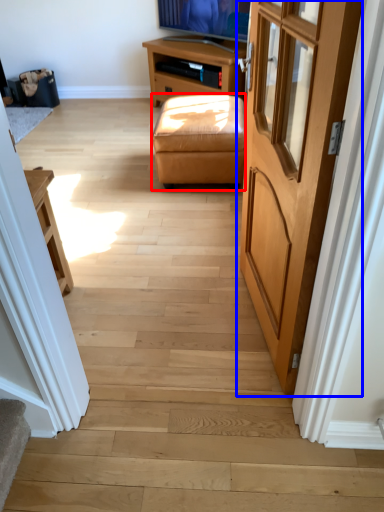
Question: Among these objects, which one is nearest to the camera, stool (highlighted by a red box) or door (highlighted by a blue box)?

Choices:
 (A) stool
 (B) door

Answer: (B)